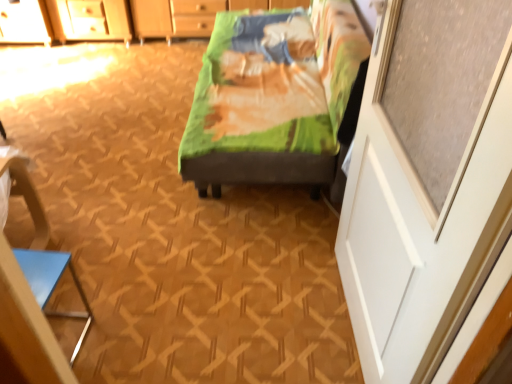
The image size is (512, 384). I want to click on free space to the left of green fabric bed at center, so click(105, 126).